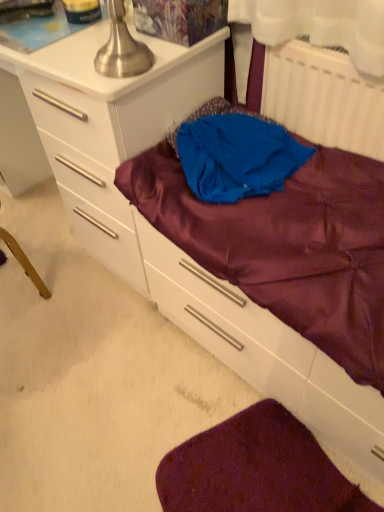
Question: Is white glossy chest of drawers at center not near purple satin sheet at lower right?

Choices:
 (A) yes
 (B) no

Answer: (B)

Question: Is white glossy chest of drawers at center positioned beyond the bounds of purple satin sheet at lower right?

Choices:
 (A) no
 (B) yes

Answer: (B)

Question: Is white glossy chest of drawers at center closer to camera compared to purple satin sheet at lower right?

Choices:
 (A) no
 (B) yes

Answer: (A)

Question: Does white glossy chest of drawers at center have a greater height compared to purple satin sheet at lower right?

Choices:
 (A) no
 (B) yes

Answer: (B)

Question: From the image's perspective, does white glossy chest of drawers at center appear lower than purple satin sheet at lower right?

Choices:
 (A) yes
 (B) no

Answer: (B)

Question: From a real-world perspective, is white glossy chest of drawers at center positioned under purple satin sheet at lower right based on gravity?

Choices:
 (A) no
 (B) yes

Answer: (A)

Question: Does white plastic radiator at upper right appear on the left side of white glossy chest of drawers at center?

Choices:
 (A) yes
 (B) no

Answer: (B)

Question: Considering the relative sizes of white plastic radiator at upper right and white glossy chest of drawers at center in the image provided, is white plastic radiator at upper right wider than white glossy chest of drawers at center?

Choices:
 (A) yes
 (B) no

Answer: (B)

Question: Does white plastic radiator at upper right have a greater height compared to white glossy chest of drawers at center?

Choices:
 (A) yes
 (B) no

Answer: (B)

Question: Is white plastic radiator at upper right to the right of white glossy chest of drawers at center from the viewer's perspective?

Choices:
 (A) yes
 (B) no

Answer: (A)

Question: From the image's perspective, is white plastic radiator at upper right above white glossy chest of drawers at center?

Choices:
 (A) no
 (B) yes

Answer: (A)

Question: From the image's perspective, is white plastic radiator at upper right below white glossy chest of drawers at center?

Choices:
 (A) yes
 (B) no

Answer: (A)

Question: From the image's perspective, is white plastic radiator at upper right below blue fabric at center?

Choices:
 (A) yes
 (B) no

Answer: (B)